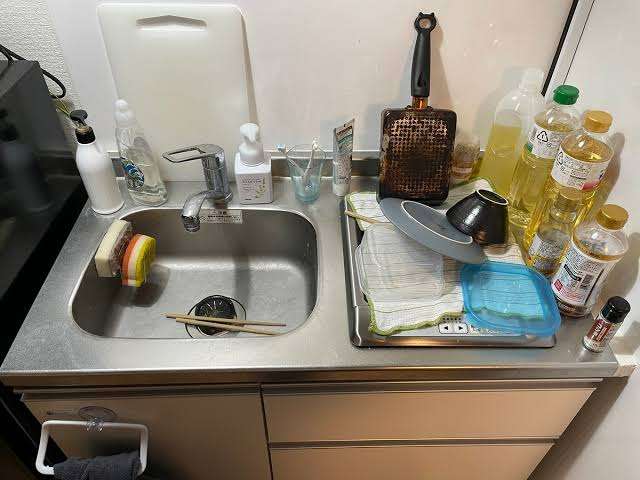
Where is `microwave`? This screenshot has height=480, width=640. microwave is located at coordinates (35, 123).